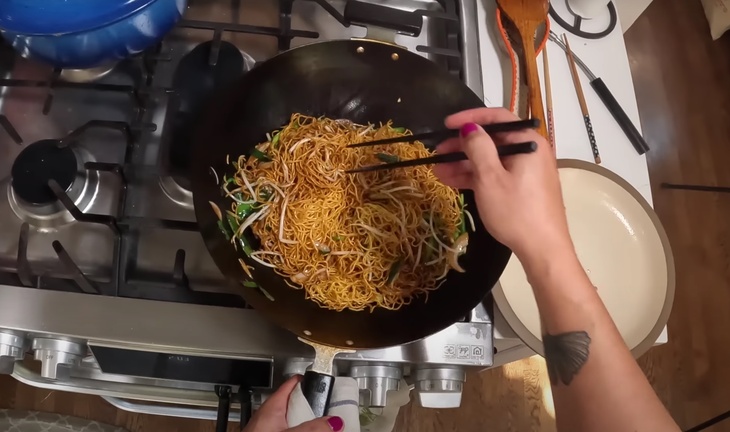
Image resolution: width=730 pixels, height=432 pixels. I want to click on spoon, so click(518, 36).